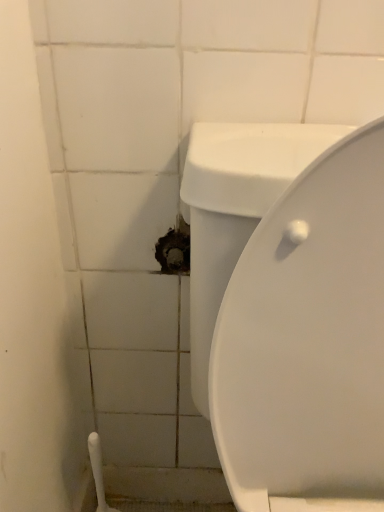
Measure the distance between point (383,215) and camera.

A distance of 13.78 inches exists between point (383,215) and camera.

The width and height of the screenshot is (384, 512). I want to click on white glossy toilet at lower right, so click(307, 342).

This screenshot has width=384, height=512. What do you see at coordinates (307, 342) in the screenshot? I see `white glossy toilet at lower right` at bounding box center [307, 342].

The width and height of the screenshot is (384, 512). I want to click on white glossy toilet at lower right, so click(x=307, y=342).